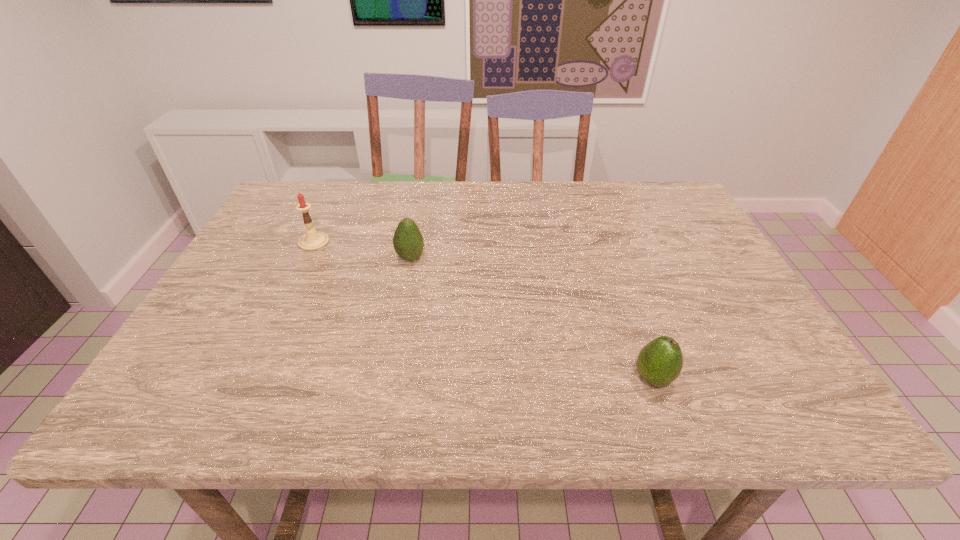
Identify which object is the second closest to the nearest object. Please provide its 2D coordinates. Your answer should be formatted as a tuple, i.e. [(x, y)], where the tuple contains the x and y coordinates of a point satisfying the conditions above.

[(312, 240)]

Where is `free region that satisfies the following two spatial constraints: 1. on the front side of the tallest object; 2. on the right side of the farther avocado`? free region that satisfies the following two spatial constraints: 1. on the front side of the tallest object; 2. on the right side of the farther avocado is located at coordinates (306, 258).

This screenshot has width=960, height=540. In order to click on vacant position in the image that satisfies the following two spatial constraints: 1. on the front side of the leftmost object; 2. on the right side of the second object from left to right in this screenshot , I will do `click(306, 258)`.

This screenshot has height=540, width=960. Identify the location of vacant space that satisfies the following two spatial constraints: 1. on the front side of the farther avocado; 2. on the right side of the rightmost object. (387, 379).

Find the location of `vacant region that satisfies the following two spatial constraints: 1. on the front side of the leftmost object; 2. on the right side of the nearest object`. vacant region that satisfies the following two spatial constraints: 1. on the front side of the leftmost object; 2. on the right side of the nearest object is located at coordinates (250, 379).